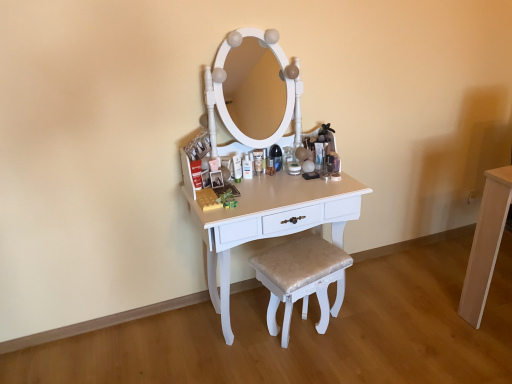
Identify the location of vacant space to the left of shiny beige cushioned stool at center. This screenshot has width=512, height=384. (241, 343).